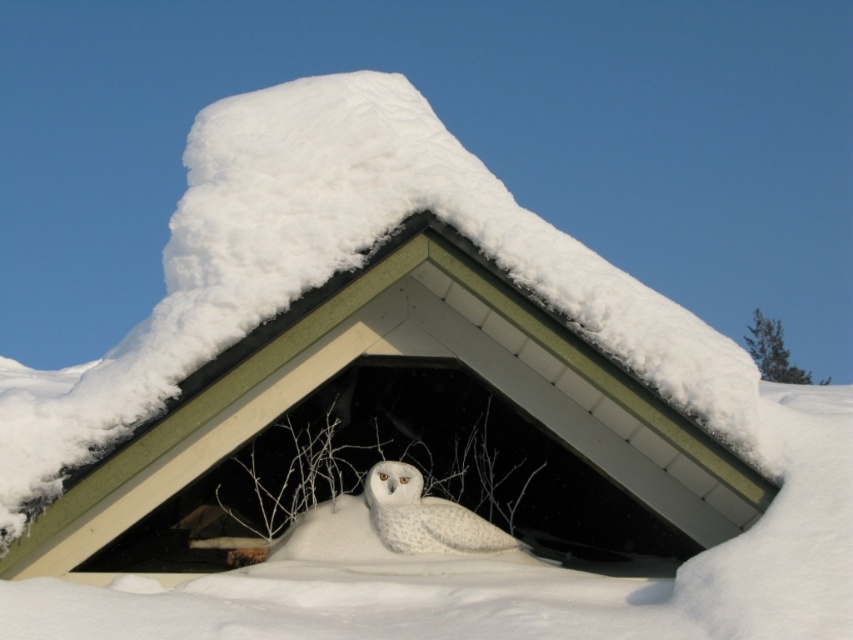
You are a photographer trying to capture the white matte owl at center and the white fluffy owl at center. Since both are at the same location, which one would appear larger in your photo?

The white matte owl at center is much taller than the white fluffy owl at center, so it would appear larger in the photo.

You are a photographer aiming to capture the white matte owl at center. Based on its coordinates, where should you position your camera to ensure it is centered in your shot?

To center the white matte owl at center in your shot, position your camera at the coordinates provided, which are at point (374, 365).